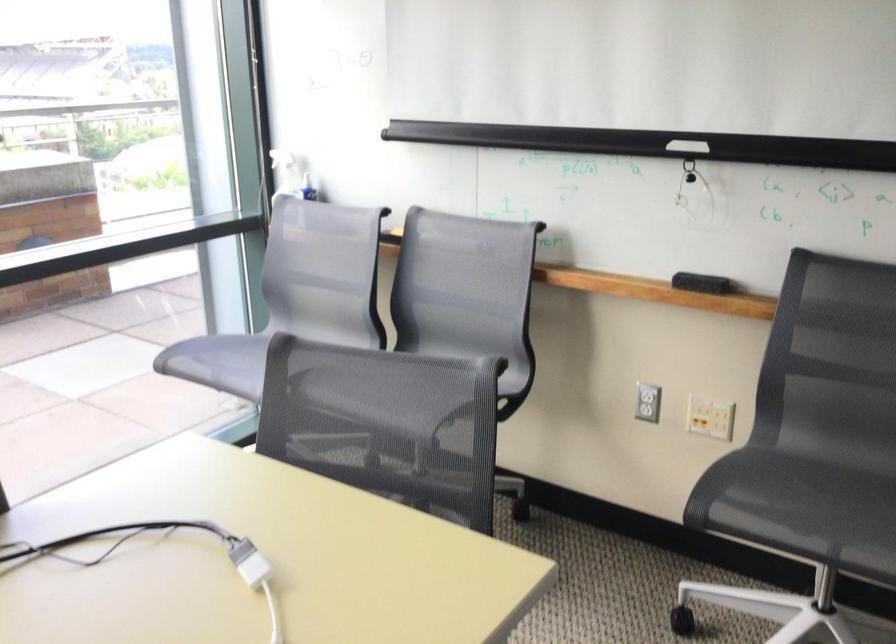
You are a GUI agent. You are given a task and a screenshot of the screen. Output one action in this format:
    pyautogui.click(x=<x>, y=<y>)
    Task: Click on the projector screen handle
    
    Given the screenshot: What is the action you would take?
    pyautogui.click(x=687, y=146)